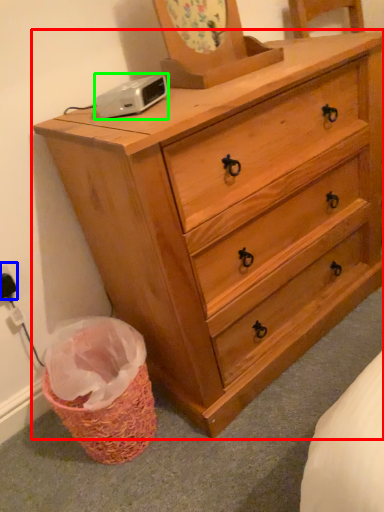
Question: Which is farther away from chest of drawers (highlighted by a red box)? electric outlet (highlighted by a blue box) or gadget (highlighted by a green box)?

Choices:
 (A) electric outlet
 (B) gadget

Answer: (A)